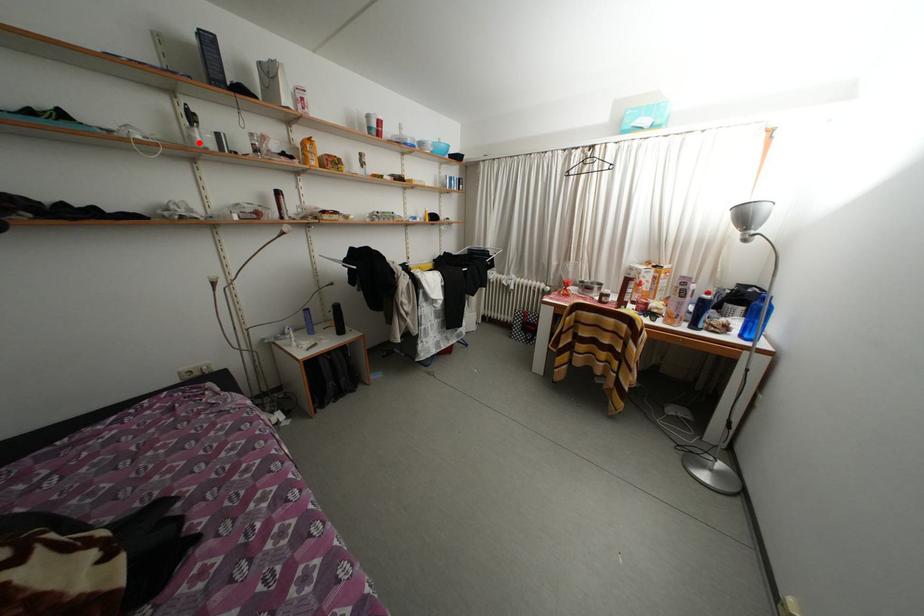
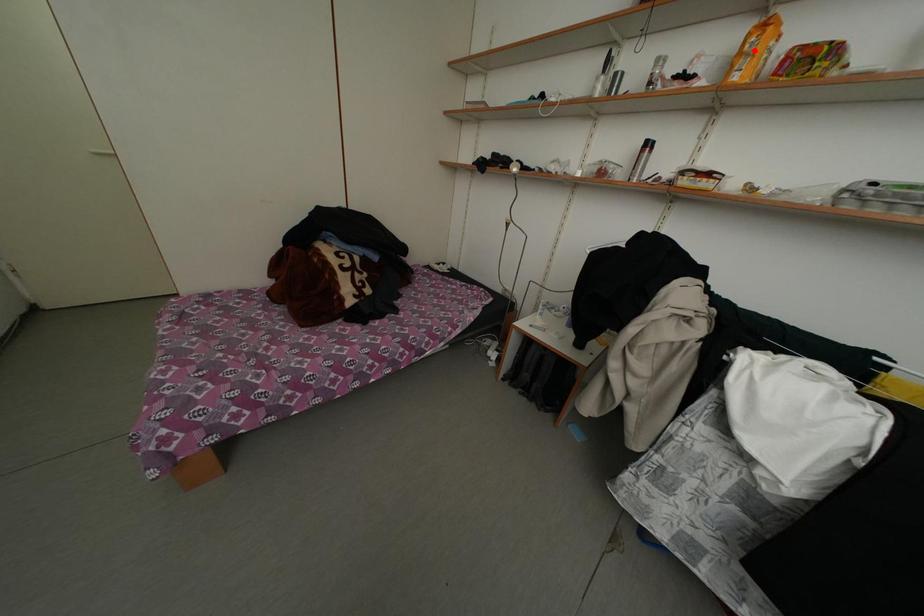
I am providing you with two images of the same scene from different viewpoints. A red point is marked on the first image and another point is marked on the second image. Do the highlighted points in image1 and image2 indicate the same real-world spot?

No